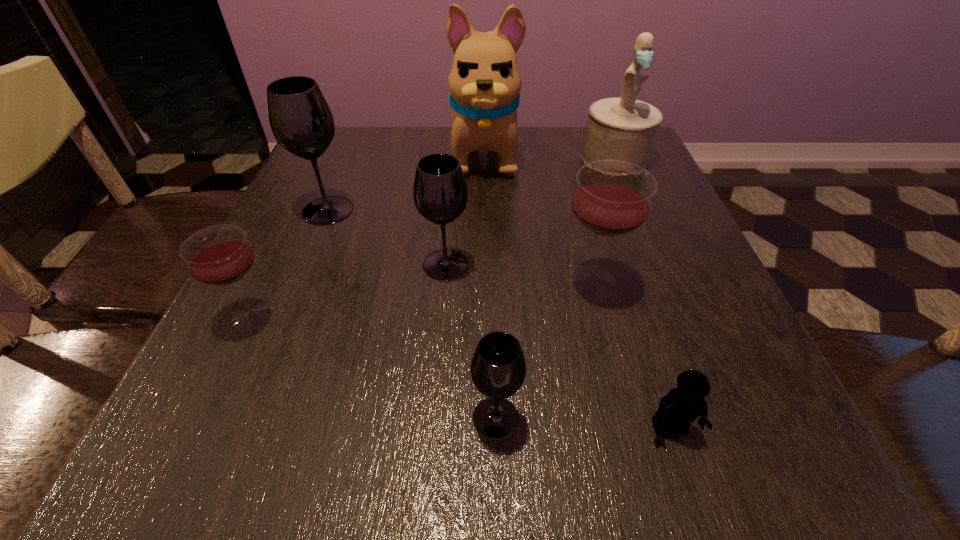
This screenshot has height=540, width=960. In order to click on free space located 0.120m on the back of the rightmost gray wineglass in this screenshot , I will do `click(493, 327)`.

In order to click on puppy that is positioned at the far edge in this screenshot , I will do `click(484, 83)`.

Find the location of `figurine that is at the far edge`. figurine that is at the far edge is located at coordinates (622, 128).

Where is `wineglass located at the near edge`? The width and height of the screenshot is (960, 540). wineglass located at the near edge is located at coordinates (498, 368).

Locate an element on the screen. Lego present at the near edge is located at coordinates (681, 406).

Identify the location of figurine present at the right edge. (622, 128).

You are a GUI agent. You are given a task and a screenshot of the screen. Output one action in this format:
    pyautogui.click(x=<x>, y=<y>)
    Task: Click on the wineglass at the right edge
    The image size is (960, 540).
    Given the screenshot: What is the action you would take?
    pyautogui.click(x=612, y=198)

Image resolution: width=960 pixels, height=540 pixels. What are the coordinates of `Lego located in the right edge section of the desktop` in the screenshot? It's located at (681, 406).

Find the location of a particular element. object present at the far right corner is located at coordinates (622, 128).

You are a GUI agent. You are given a task and a screenshot of the screen. Output one action in this format:
    pyautogui.click(x=<x>, y=<y>)
    Task: Click on the object situated at the near right corner
    This screenshot has height=540, width=960.
    Given the screenshot: What is the action you would take?
    pyautogui.click(x=681, y=406)